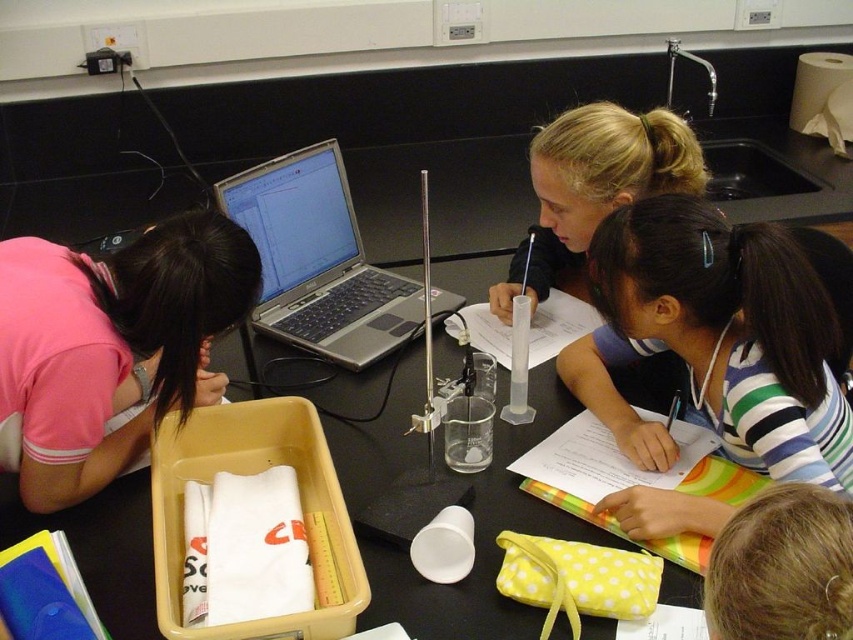
Question: Among these objects, which one is farthest from the camera?

Choices:
 (A) striped fabric shirt at center
 (B) silver metallic laptop at center

Answer: (B)

Question: Is the position of silver metallic laptop at center less distant than that of blonde hair at upper center?

Choices:
 (A) yes
 (B) no

Answer: (B)

Question: Among these points, which one is nearest to the camera?

Choices:
 (A) (142, 448)
 (B) (328, 154)

Answer: (A)

Question: Which of the following is the closest to the observer?

Choices:
 (A) blonde hair at upper center
 (B) striped fabric shirt at center
 (C) silver metallic laptop at center
 (D) pink fabric at left

Answer: (A)

Question: Is pink fabric at left positioned behind silver metallic laptop at center?

Choices:
 (A) no
 (B) yes

Answer: (A)

Question: From the image, what is the correct spatial relationship of pink fabric at left in relation to blonde hair at upper center?

Choices:
 (A) left
 (B) right

Answer: (A)